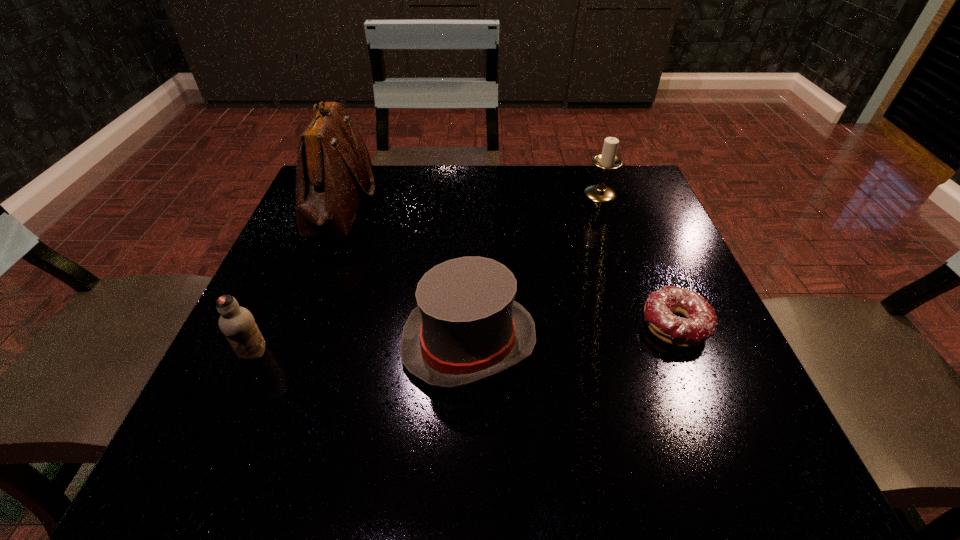
In order to click on unoccupied area between the shortest object and the dress hat in this screenshot , I will do (572, 334).

This screenshot has height=540, width=960. Find the location of `empty space between the doughnut and the candle holder`. empty space between the doughnut and the candle holder is located at coordinates (637, 260).

Select which object appears as the fourth closest to the tallest object. Please provide its 2D coordinates. Your answer should be formatted as a tuple, i.e. [(x, y)], where the tuple contains the x and y coordinates of a point satisfying the conditions above.

[(700, 323)]

Locate an element on the screen. Image resolution: width=960 pixels, height=540 pixels. the closest object to the doughnut is located at coordinates (467, 327).

Find the location of a particular element. The image size is (960, 540). free location that satisfies the following two spatial constraints: 1. on the back side of the chocolate milk; 2. on the left side of the third object from right to left is located at coordinates [259, 342].

Find the location of `vacant area in the image that satisfies the following two spatial constraints: 1. on the back side of the chocolate milk; 2. on the right side of the tallest object`. vacant area in the image that satisfies the following two spatial constraints: 1. on the back side of the chocolate milk; 2. on the right side of the tallest object is located at coordinates (323, 201).

Locate an element on the screen. This screenshot has width=960, height=540. free space that satisfies the following two spatial constraints: 1. on the back side of the candle holder; 2. on the right side of the shoulder bag is located at coordinates (344, 194).